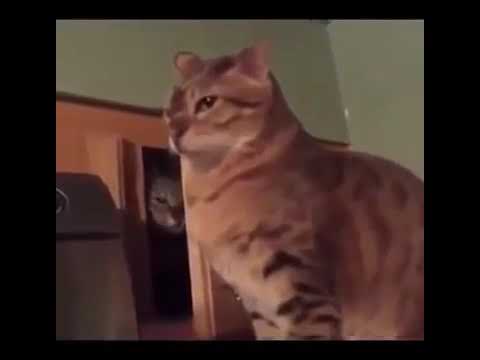
Locate an element on the screen. The width and height of the screenshot is (480, 360). corner is located at coordinates (312, 29).